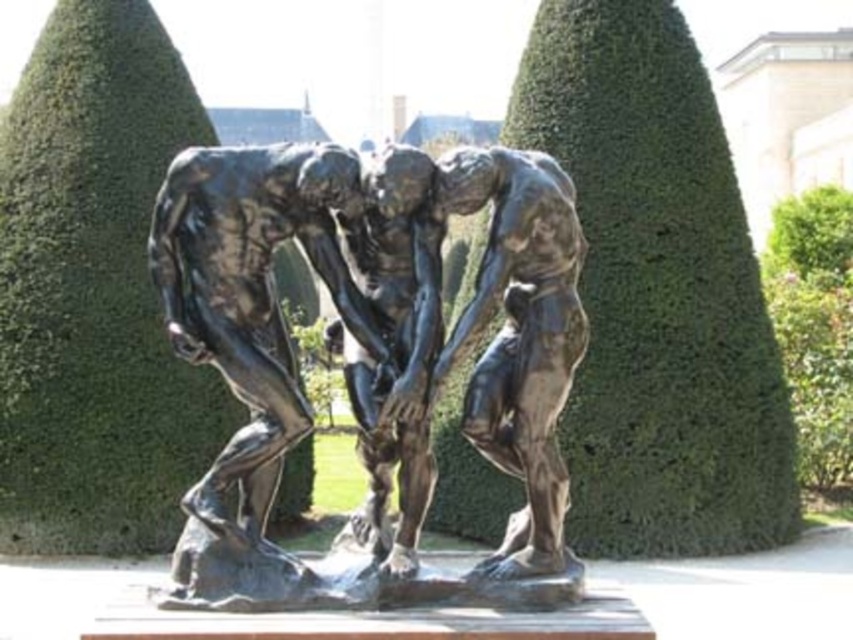
Question: Which point is closer to the camera?

Choices:
 (A) pyautogui.click(x=786, y=307)
 (B) pyautogui.click(x=784, y=225)
 (C) pyautogui.click(x=683, y=93)

Answer: (C)

Question: Among these points, which one is farthest from the camera?

Choices:
 (A) (827, 230)
 (B) (737, 256)

Answer: (A)

Question: Estimate the real-world distances between objects in this image. Which object is farther from the green leafy bush at upper right?

Choices:
 (A) green leafy bush at right
 (B) bronze sculpture at center
 (C) green leafy hedge at center

Answer: (B)

Question: Is bronze sculpture at center below green leafy bush at upper right?

Choices:
 (A) no
 (B) yes

Answer: (B)

Question: Is green leafy bush at right to the left of green leafy bush at upper right from the viewer's perspective?

Choices:
 (A) no
 (B) yes

Answer: (B)

Question: Is the position of green leafy bush at right more distant than that of green leafy bush at upper right?

Choices:
 (A) yes
 (B) no

Answer: (B)